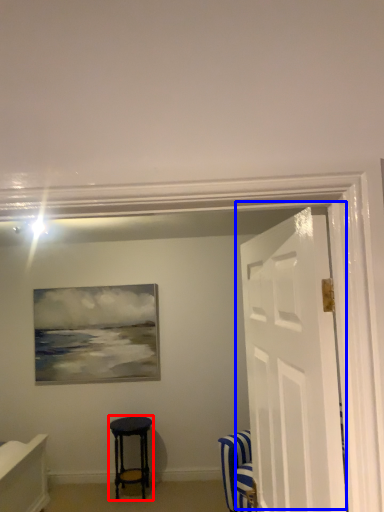
Question: Which of the following is the farthest to the observer, stool (highlighted by a red box) or door (highlighted by a blue box)?

Choices:
 (A) stool
 (B) door

Answer: (A)